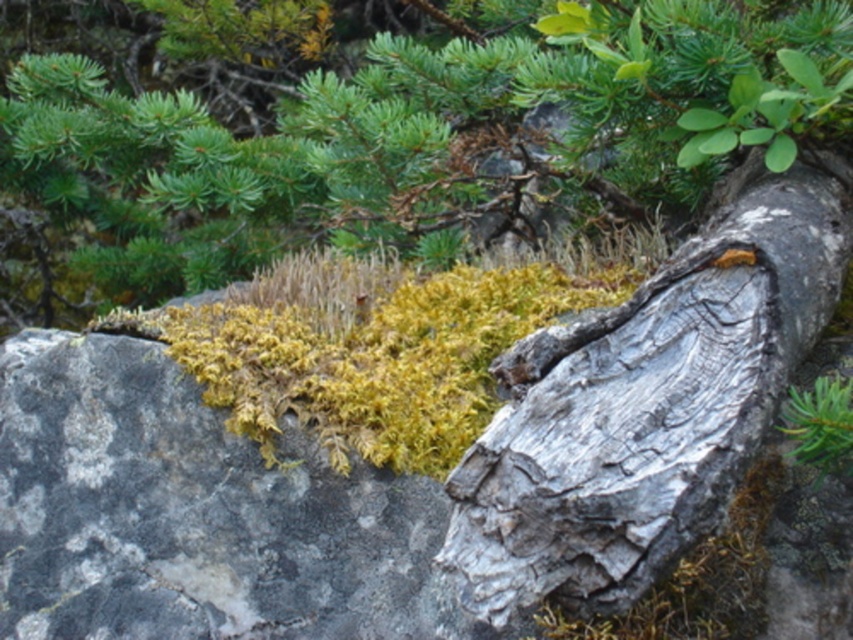
Is point (686, 314) positioned in front of point (354, 412)?

Yes.

Who is positioned more to the left, gray rough bark tree trunk at center or yellow-green moss at center?

From the viewer's perspective, yellow-green moss at center appears more on the left side.

Is point (756, 358) farther from viewer compared to point (254, 339)?

No, (756, 358) is closer to viewer.

I want to click on gray rough bark tree trunk at center, so click(647, 404).

The height and width of the screenshot is (640, 853). In order to click on green leafy tree at upper center in this screenshot , I will do `click(430, 136)`.

Does green leafy tree at upper center lie in front of yellow-green moss at center?

That is True.

Is point (90, 195) closer to camera compared to point (483, 396)?

No, (90, 195) is behind (483, 396).

Find the location of a particular element. Image resolution: width=853 pixels, height=640 pixels. green leafy tree at upper center is located at coordinates (430, 136).

Between gray rough bark tree trunk at center and green leafy plant at upper right, which one is positioned higher?

gray rough bark tree trunk at center

Between point (627, 317) and point (805, 412), which one is positioned in front?

Positioned in front is point (805, 412).

In order to click on gray rough bark tree trunk at center in this screenshot , I will do `click(647, 404)`.

The width and height of the screenshot is (853, 640). Find the location of `gray rough bark tree trunk at center`. gray rough bark tree trunk at center is located at coordinates (647, 404).